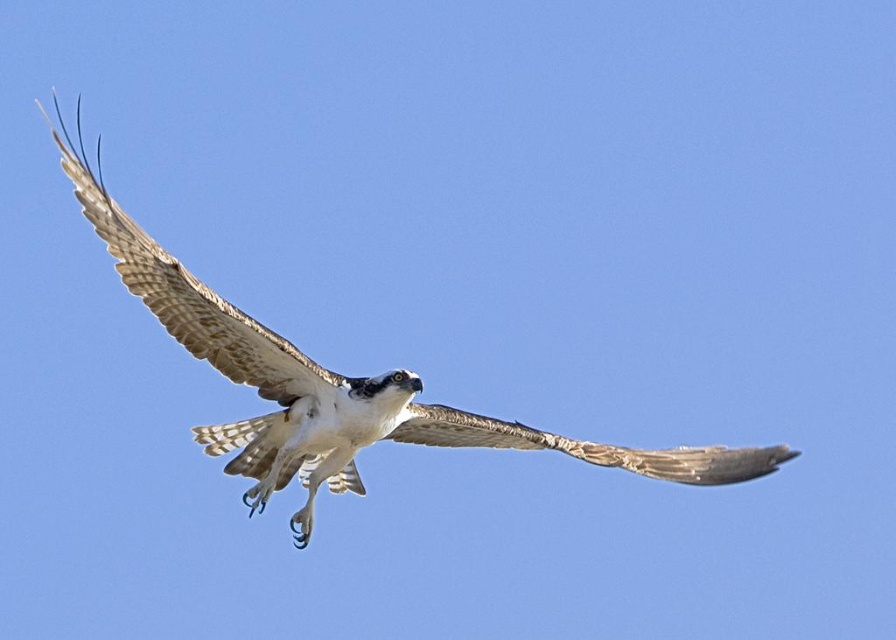
Question: Which of the following is the closest to the observer?

Choices:
 (A) (592, 460)
 (B) (113, 252)
 (C) (300, 461)

Answer: (B)

Question: Which object appears closest to the camera in this image?

Choices:
 (A) white feathered bird at center
 (B) brown textured wing at upper left
 (C) brown textured wing at center

Answer: (B)

Question: Can you confirm if white feathered bird at center is positioned above brown textured wing at upper left?

Choices:
 (A) no
 (B) yes

Answer: (A)

Question: Is brown textured wing at upper left above brown textured wing at center?

Choices:
 (A) yes
 (B) no

Answer: (A)

Question: Which point is closer to the camera?

Choices:
 (A) brown textured wing at center
 (B) white feathered bird at center
 (C) brown textured wing at upper left

Answer: (C)

Question: From the image, what is the correct spatial relationship of white feathered bird at center in relation to brown textured wing at center?

Choices:
 (A) left
 (B) right

Answer: (A)